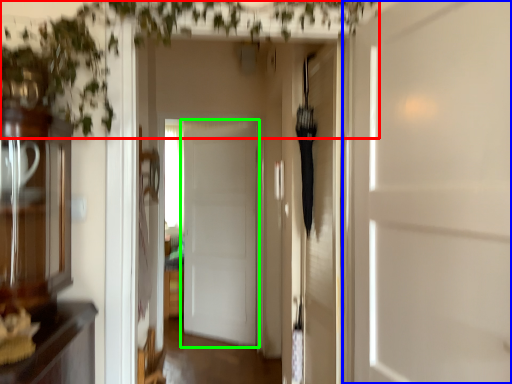
Question: Considering the real-world distances, which object is closest to vegetation (highlighted by a red box)? door (highlighted by a blue box) or door (highlighted by a green box).

Choices:
 (A) door
 (B) door

Answer: (A)